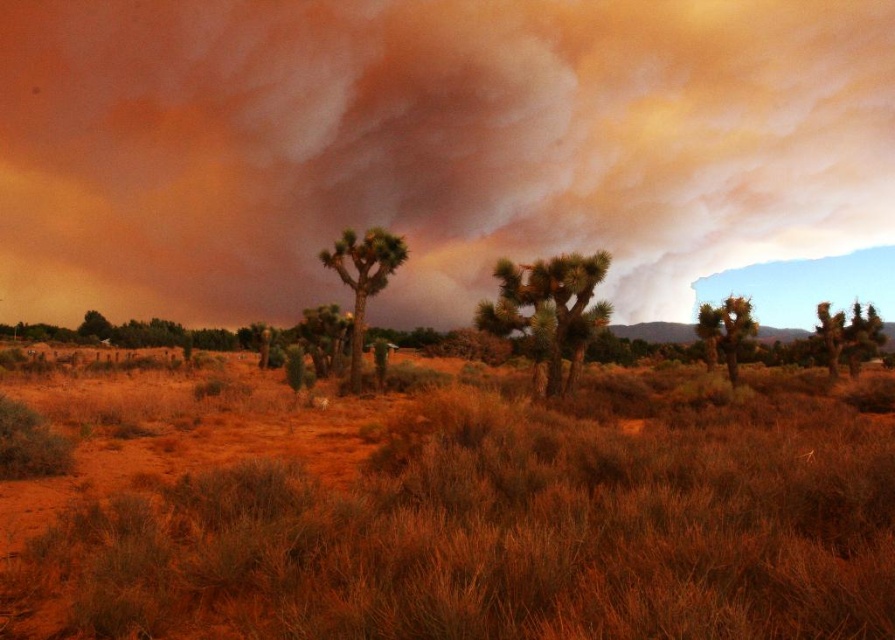
Question: Which point is closer to the camera?

Choices:
 (A) brown grass at center
 (B) brown textured joshua tree at center
 (C) brown textured cloud at upper center
 (D) green leafy tree at center

Answer: (A)

Question: Does brown textured cloud at upper center have a greater width compared to brown grass at center?

Choices:
 (A) no
 (B) yes

Answer: (B)

Question: Is brown textured cloud at upper center above green textured tree at center?

Choices:
 (A) no
 (B) yes

Answer: (B)

Question: Which point appears farthest from the camera in this image?

Choices:
 (A) (436, 365)
 (B) (830, 314)
 (C) (709, 336)
 (D) (386, 264)

Answer: (A)

Question: Is brown textured cloud at upper center further to camera compared to green leafy tree at right?

Choices:
 (A) yes
 (B) no

Answer: (B)

Question: Which point appears farthest from the camera in this image?

Choices:
 (A) (339, 65)
 (B) (841, 340)
 (C) (348, 234)
 (D) (524, 294)

Answer: (A)